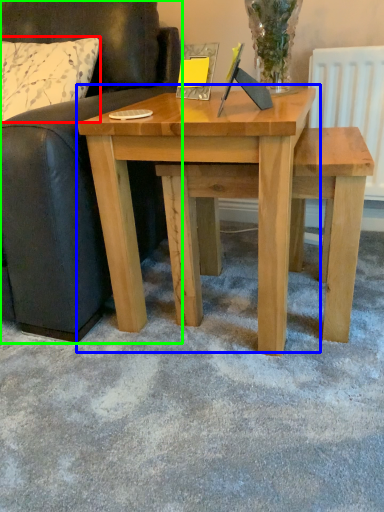
Question: Which object is the farthest from pillow (highlighted by a red box)? Choose among these: table (highlighted by a blue box) or studio couch (highlighted by a green box).

Choices:
 (A) table
 (B) studio couch

Answer: (A)